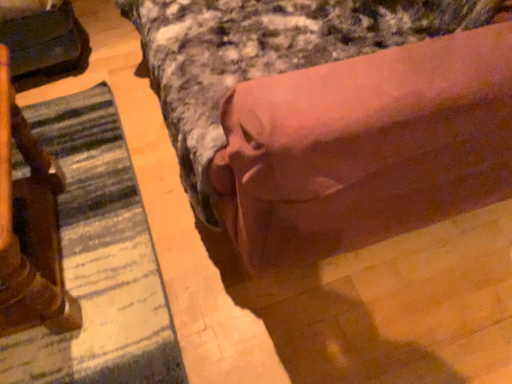
What is the approximate height of brown fabric bed at center?

It is 30.88 inches.

This screenshot has height=384, width=512. What do you see at coordinates (42, 41) in the screenshot?
I see `matte black swivel chair at left` at bounding box center [42, 41].

Identify the location of wooden statue at left. coord(30,229).

Between matte black swivel chair at left and wooden statue at left, which one appears on the right side from the viewer's perspective?

wooden statue at left is more to the right.

Is the surface of matte black swivel chair at left in direct contact with wooden statue at left?

No, matte black swivel chair at left is not next to wooden statue at left.

The width and height of the screenshot is (512, 384). I want to click on swivel chair behind the wooden statue at left, so click(x=42, y=41).

How many degrees apart are the facing directions of matte black swivel chair at left and wooden statue at left?

They differ by 9.7 degrees in their facing directions.

Does brown fabric bed at center appear on the right side of striped fabric mat at lower left?

Yes.

How much distance is there between brown fabric bed at center and striped fabric mat at lower left?

The distance of brown fabric bed at center from striped fabric mat at lower left is 22.66 inches.

From a real-world perspective, is brown fabric bed at center positioned above or below striped fabric mat at lower left?

brown fabric bed at center is situated higher than striped fabric mat at lower left in the real world.

Which point is more forward, (388, 133) or (4, 340)?

The point (388, 133) is more forward.

How far apart are striped fabric mat at lower left and wooden statue at left?

14.04 centimeters.

Consider the image. Can you confirm if striped fabric mat at lower left is shorter than wooden statue at left?

Correct, striped fabric mat at lower left is not as tall as wooden statue at left.

Is striped fabric mat at lower left placed right next to wooden statue at left?

No, striped fabric mat at lower left is not beside wooden statue at left.

Considering the relative sizes of striped fabric mat at lower left and wooden statue at left in the image provided, is striped fabric mat at lower left wider than wooden statue at left?

Correct, the width of striped fabric mat at lower left exceeds that of wooden statue at left.

Between wooden statue at left and matte black swivel chair at left, which one appears on the right side from the viewer's perspective?

Positioned to the right is wooden statue at left.

Considering the sizes of objects wooden statue at left and matte black swivel chair at left in the image provided, who is thinner, wooden statue at left or matte black swivel chair at left?

With smaller width is wooden statue at left.

I want to click on swivel chair that is behind the wooden statue at left, so click(x=42, y=41).

Does wooden statue at left have a greater height compared to brown fabric bed at center?

Incorrect, the height of wooden statue at left is not larger of that of brown fabric bed at center.

Based on the photo, which of these two, wooden statue at left or brown fabric bed at center, is bigger?

brown fabric bed at center is bigger.

Considering the relative sizes of matte black swivel chair at left and brown fabric bed at center in the image provided, is matte black swivel chair at left smaller than brown fabric bed at center?

Yes.

Considering the sizes of objects matte black swivel chair at left and brown fabric bed at center in the image provided, who is taller, matte black swivel chair at left or brown fabric bed at center?

Standing taller between the two is brown fabric bed at center.

Is matte black swivel chair at left not within brown fabric bed at center?

Yes, matte black swivel chair at left is not within brown fabric bed at center.

Which object is wider, matte black swivel chair at left or brown fabric bed at center?

Wider between the two is brown fabric bed at center.

This screenshot has height=384, width=512. What are the coordinates of `furniture below the brown fabric bed at center (from a real-world perspective)` in the screenshot? It's located at (30, 229).

Between brown fabric bed at center and wooden statue at left, which one has smaller size?

wooden statue at left.

Is brown fabric bed at center not near wooden statue at left?

No, brown fabric bed at center is in close proximity to wooden statue at left.

Which is closer to the camera, [469,88] or [2,84]?

The point [469,88] is in front.

The width and height of the screenshot is (512, 384). Find the location of `furniture that is below the matte black swivel chair at left (from the image's perspective)`. furniture that is below the matte black swivel chair at left (from the image's perspective) is located at coordinates (30, 229).

Locate an element on the screen. The width and height of the screenshot is (512, 384). bed above the striped fabric mat at lower left (from the image's perspective) is located at coordinates (331, 116).

Based on their spatial positions, is brown fabric bed at center or wooden statue at left closer to striped fabric mat at lower left?

Among the two, wooden statue at left is located nearer to striped fabric mat at lower left.

Based on their spatial positions, is striped fabric mat at lower left or brown fabric bed at center closer to matte black swivel chair at left?

striped fabric mat at lower left is closer to matte black swivel chair at left.

Considering their positions, is brown fabric bed at center positioned closer to wooden statue at left than striped fabric mat at lower left?

striped fabric mat at lower left.

Estimate the real-world distances between objects in this image. Which object is further from striped fabric mat at lower left, matte black swivel chair at left or brown fabric bed at center?

brown fabric bed at center lies further to striped fabric mat at lower left than the other object.

Estimate the real-world distances between objects in this image. Which object is closer to matte black swivel chair at left, brown fabric bed at center or striped fabric mat at lower left?

The object closer to matte black swivel chair at left is striped fabric mat at lower left.

Estimate the real-world distances between objects in this image. Which object is further from matte black swivel chair at left, wooden statue at left or striped fabric mat at lower left?

wooden statue at left.

Looking at the image, which one is located further to wooden statue at left, matte black swivel chair at left or brown fabric bed at center?

brown fabric bed at center lies further to wooden statue at left than the other object.

Considering their positions, is matte black swivel chair at left positioned further to brown fabric bed at center than wooden statue at left?

The object further to brown fabric bed at center is matte black swivel chair at left.

Locate an element on the screen. This screenshot has height=384, width=512. furniture situated between matte black swivel chair at left and brown fabric bed at center from left to right is located at coordinates (30, 229).

Find the location of a particular element. Image resolution: width=512 pixels, height=384 pixels. furniture that lies between matte black swivel chair at left and striped fabric mat at lower left from top to bottom is located at coordinates (30, 229).

You are a GUI agent. You are given a task and a screenshot of the screen. Output one action in this format:
    pyautogui.click(x=<x>, y=<y>)
    Task: Click on the furniture between brown fabric bed at center and striped fabric mat at lower left in the vertical direction
    
    Given the screenshot: What is the action you would take?
    pyautogui.click(x=30, y=229)

I want to click on mat between matte black swivel chair at left and brown fabric bed at center in the horizontal direction, so click(x=98, y=260).